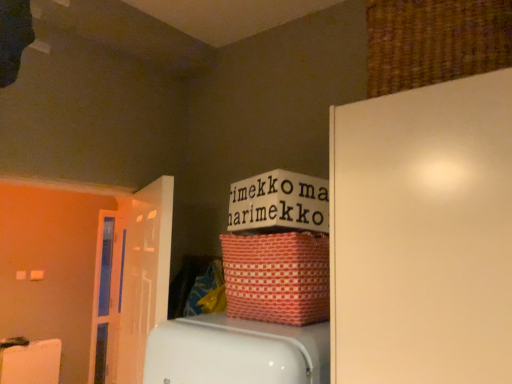
I want to click on white glossy door at left, acting as the second door starting from the left, so click(x=133, y=281).

In order to face woven brown basket at upper right, arranged as the 1th basket when viewed from the top, should I rotate leftwards or rightwards?

Rotate your view right by about 23.051°.

Identify the location of woven brown basket at upper right, arranged as the 1th basket when viewed from the top. (434, 41).

In order to face transparent glass door at left, which is the second door from front to back, should I rotate leftwards or rightwards?

To align with it, rotate left about 19.981°.

Locate an element on the screen. white glossy door at left, the 1th door positioned from the front is located at coordinates (133, 281).

Is transparent glass door at left, the 2th door in the right-to-left sequence, inside or outside of woven brown basket at upper right, the 1th basket positioned from the right?

transparent glass door at left, the 2th door in the right-to-left sequence, lies outside woven brown basket at upper right, the 1th basket positioned from the right.

Which object is further away from the camera, transparent glass door at left, the 2th door in the right-to-left sequence, or woven brown basket at upper right, arranged as the 1th basket when viewed from the top?

transparent glass door at left, the 2th door in the right-to-left sequence, is more distant.

Which is nearer, [93,341] or [436,69]?

Point [93,341].

Could you measure the distance between white glossy door at left, the second door positioned from the back, and red woven basket at upper center, which is the 2th basket from right to left?

A distance of 19.62 inches exists between white glossy door at left, the second door positioned from the back, and red woven basket at upper center, which is the 2th basket from right to left.

From a real-world perspective, is white glossy door at left, the second door positioned from the back, above or below red woven basket at upper center, arranged as the 2th basket when viewed from the top?

white glossy door at left, the second door positioned from the back, is below red woven basket at upper center, arranged as the 2th basket when viewed from the top.

From the image's perspective, is white glossy door at left, the first door positioned from the right, above or below red woven basket at upper center, the first basket from the left?

From the image's perspective, white glossy door at left, the first door positioned from the right, appears below red woven basket at upper center, the first basket from the left.

Can you see white glossy door at left, acting as the second door starting from the left, touching red woven basket at upper center, placed as the 1th basket when sorted from bottom to top?

white glossy door at left, acting as the second door starting from the left, and red woven basket at upper center, placed as the 1th basket when sorted from bottom to top, are not in contact.

Consider the image. Is white glossy door at left, the 1th door positioned from the front, wider or thinner than woven brown basket at upper right, placed as the second basket when sorted from bottom to top?

Considering their sizes, white glossy door at left, the 1th door positioned from the front, looks slimmer than woven brown basket at upper right, placed as the second basket when sorted from bottom to top.

Is woven brown basket at upper right, placed as the second basket when sorted from bottom to top, completely or partially inside white glossy door at left, acting as the second door starting from the left?

No, woven brown basket at upper right, placed as the second basket when sorted from bottom to top, is not surrounded by white glossy door at left, acting as the second door starting from the left.

Considering the relative sizes of white glossy door at left, the second door positioned from the back, and woven brown basket at upper right, the 1th basket positioned from the right, in the image provided, is white glossy door at left, the second door positioned from the back, smaller than woven brown basket at upper right, the 1th basket positioned from the right,?

No.

From the image's perspective, does white glossy door at left, acting as the second door starting from the left, appear lower than woven brown basket at upper right, the 1th basket positioned from the right?

Yes, from the image's perspective, white glossy door at left, acting as the second door starting from the left, is beneath woven brown basket at upper right, the 1th basket positioned from the right.

Can you confirm if white glossy door at left, acting as the second door starting from the left, is positioned to the left of transparent glass door at left, the 2th door in the right-to-left sequence?

In fact, white glossy door at left, acting as the second door starting from the left, is to the right of transparent glass door at left, the 2th door in the right-to-left sequence.

How distant is white glossy door at left, the 1th door positioned from the front, from transparent glass door at left, the first door viewed from the left?

They are 7.89 inches apart.

Is white glossy door at left, the first door positioned from the right, situated inside transparent glass door at left, the 2th door in the right-to-left sequence, or outside?

white glossy door at left, the first door positioned from the right, lies outside transparent glass door at left, the 2th door in the right-to-left sequence.

Considering the relative sizes of white glossy door at left, the 1th door positioned from the front, and transparent glass door at left, the first door viewed from the left, in the image provided, is white glossy door at left, the 1th door positioned from the front, shorter than transparent glass door at left, the first door viewed from the left,?

Yes, white glossy door at left, the 1th door positioned from the front, is shorter than transparent glass door at left, the first door viewed from the left.

Considering the positions of points (101, 332) and (124, 223), is point (101, 332) closer to camera compared to point (124, 223)?

No, (101, 332) is further to viewer.

Is transparent glass door at left, which is the second door from front to back, facing away from white glossy door at left, the 1th door positioned from the front?

transparent glass door at left, which is the second door from front to back, is not turned away from white glossy door at left, the 1th door positioned from the front.

From a real-world perspective, which is physically above, transparent glass door at left, the 2th door in the right-to-left sequence, or white glossy door at left, the 1th door positioned from the front?

white glossy door at left, the 1th door positioned from the front, from a real-world perspective.

Is woven brown basket at upper right, placed as the second basket when sorted from bottom to top, positioned in front of red woven basket at upper center, placed as the 1th basket when sorted from bottom to top?

Yes, woven brown basket at upper right, placed as the second basket when sorted from bottom to top, is closer to the viewer.

From a real-world perspective, is woven brown basket at upper right, arranged as the 1th basket when viewed from the top, located beneath red woven basket at upper center, arranged as the 2th basket when viewed from the top?

No, from a real-world perspective, woven brown basket at upper right, arranged as the 1th basket when viewed from the top, is not below red woven basket at upper center, arranged as the 2th basket when viewed from the top.

Based on the photo, is woven brown basket at upper right, the 1th basket positioned from the right, not inside red woven basket at upper center, placed as the 1th basket when sorted from bottom to top?

Absolutely, woven brown basket at upper right, the 1th basket positioned from the right, is external to red woven basket at upper center, placed as the 1th basket when sorted from bottom to top.

From the image's perspective, is woven brown basket at upper right, the 1th basket positioned from the right, above red woven basket at upper center, which is the 2th basket from right to left?

Yes, from the image's perspective, woven brown basket at upper right, the 1th basket positioned from the right, is on top of red woven basket at upper center, which is the 2th basket from right to left.

Between woven brown basket at upper right, placed as the second basket when sorted from bottom to top, and white glossy door at left, the second door positioned from the back, which one has smaller width?

white glossy door at left, the second door positioned from the back, is thinner.

From the image's perspective, which object appears higher, woven brown basket at upper right, placed as the second basket when sorted from bottom to top, or white glossy door at left, the second door positioned from the back?

woven brown basket at upper right, placed as the second basket when sorted from bottom to top, from the image's perspective.

Is woven brown basket at upper right, placed as the second basket when sorted from bottom to top, facing towards white glossy door at left, the 1th door positioned from the front?

No.

Is woven brown basket at upper right, arranged as the 1th basket when viewed from the top, far away from white glossy door at left, the first door positioned from the right?

woven brown basket at upper right, arranged as the 1th basket when viewed from the top, is far away from white glossy door at left, the first door positioned from the right.

Locate an element on the screen. The height and width of the screenshot is (384, 512). the 2nd basket in front of the transparent glass door at left, the 2th door in the right-to-left sequence, counting from the anchor's position is located at coordinates coord(434,41).

From a real-world perspective, count 1st doors downward from the red woven basket at upper center, placed as the 1th basket when sorted from bottom to top, and point to it. Please provide its 2D coordinates.

[(133, 281)]

Based on their spatial positions, is white glossy door at left, acting as the second door starting from the left, or red woven basket at upper center, the first basket from the left, further from transparent glass door at left, which is the second door from front to back?

red woven basket at upper center, the first basket from the left, is positioned further to the anchor transparent glass door at left, which is the second door from front to back.

Looking at the image, which one is located further to woven brown basket at upper right, the 1th basket positioned from the right, red woven basket at upper center, placed as the 1th basket when sorted from bottom to top, or transparent glass door at left, the 2th door in the right-to-left sequence?

transparent glass door at left, the 2th door in the right-to-left sequence, lies further to woven brown basket at upper right, the 1th basket positioned from the right, than the other object.

Considering their positions, is woven brown basket at upper right, arranged as the 1th basket when viewed from the top, positioned further to white glossy door at left, acting as the second door starting from the left, than red woven basket at upper center, placed as the 1th basket when sorted from bottom to top?

woven brown basket at upper right, arranged as the 1th basket when viewed from the top, lies further to white glossy door at left, acting as the second door starting from the left, than the other object.

From the image, which object appears to be nearer to transparent glass door at left, which is the second door from front to back, red woven basket at upper center, arranged as the 2th basket when viewed from the top, or white glossy door at left, the 1th door positioned from the front?

Among the two, white glossy door at left, the 1th door positioned from the front, is located nearer to transparent glass door at left, which is the second door from front to back.

Which object lies nearer to the anchor point white glossy door at left, the 1th door positioned from the front, red woven basket at upper center, placed as the 1th basket when sorted from bottom to top, or woven brown basket at upper right, placed as the second basket when sorted from bottom to top?

The object closer to white glossy door at left, the 1th door positioned from the front, is red woven basket at upper center, placed as the 1th basket when sorted from bottom to top.

Based on their spatial positions, is woven brown basket at upper right, which is the 2th basket from left to right, or white glossy door at left, the first door positioned from the right, further from red woven basket at upper center, which is the 2th basket from right to left?

The object further to red woven basket at upper center, which is the 2th basket from right to left, is woven brown basket at upper right, which is the 2th basket from left to right.

Considering their positions, is woven brown basket at upper right, which is the 2th basket from left to right, positioned further to white glossy door at left, the 1th door positioned from the front, than transparent glass door at left, the 2th door in the right-to-left sequence?

woven brown basket at upper right, which is the 2th basket from left to right, lies further to white glossy door at left, the 1th door positioned from the front, than the other object.

Based on their spatial positions, is white glossy door at left, the 1th door positioned from the front, or transparent glass door at left, the 2th door in the right-to-left sequence, further from red woven basket at upper center, which is the 2th basket from right to left?

transparent glass door at left, the 2th door in the right-to-left sequence, is further to red woven basket at upper center, which is the 2th basket from right to left.

You are a GUI agent. You are given a task and a screenshot of the screen. Output one action in this format:
    pyautogui.click(x=<x>, y=<y>)
    Task: Click on the basket between white glossy door at left, the second door positioned from the back, and woven brown basket at upper right, the 1th basket positioned from the right, in the horizontal direction
    The width and height of the screenshot is (512, 384).
    Given the screenshot: What is the action you would take?
    tap(277, 277)

Find the location of a particular element. This screenshot has height=384, width=512. basket between woven brown basket at upper right, placed as the second basket when sorted from bottom to top, and transparent glass door at left, which is the second door from front to back, along the z-axis is located at coordinates (277, 277).

Where is `door located between red woven basket at upper center, placed as the 1th basket when sorted from bottom to top, and transparent glass door at left, the 2th door in the right-to-left sequence, in the depth direction`? This screenshot has width=512, height=384. door located between red woven basket at upper center, placed as the 1th basket when sorted from bottom to top, and transparent glass door at left, the 2th door in the right-to-left sequence, in the depth direction is located at coordinates (133, 281).

Image resolution: width=512 pixels, height=384 pixels. Identify the location of door located between woven brown basket at upper right, arranged as the 1th basket when viewed from the top, and transparent glass door at left, the 2th door in the right-to-left sequence, in the depth direction. (133, 281).